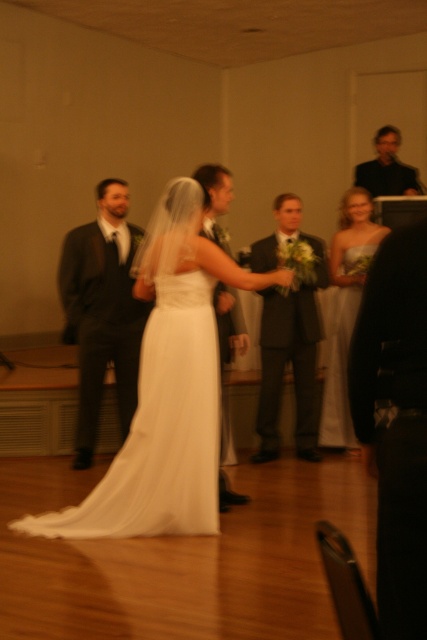
The width and height of the screenshot is (427, 640). What do you see at coordinates (161, 428) in the screenshot?
I see `white satin dress at center` at bounding box center [161, 428].

Does white satin dress at center have a lesser width compared to matte black suit at left?

No.

This screenshot has height=640, width=427. Identify the location of white satin dress at center. (161, 428).

Image resolution: width=427 pixels, height=640 pixels. Find the location of `white satin dress at center`. white satin dress at center is located at coordinates (161, 428).

How distant is matte black suit at left from matte black suit at upper right?

matte black suit at left is 12.63 feet from matte black suit at upper right.

Is matte black suit at left shorter than matte black suit at upper right?

In fact, matte black suit at left may be taller than matte black suit at upper right.

Between point (84, 298) and point (394, 180), which one is positioned in front?

Point (84, 298)

Find the location of a particular element. This screenshot has width=427, height=640. matte black suit at left is located at coordinates (102, 310).

Does white satin dress at center have a lesser height compared to matte black suit at upper right?

In fact, white satin dress at center may be taller than matte black suit at upper right.

At what (x,y) coordinates should I click in order to perform the action: click on white satin dress at center. Please return your answer as a coordinate pair (x, y). This screenshot has height=640, width=427. Looking at the image, I should click on [x=161, y=428].

Identify the location of white satin dress at center. (161, 428).